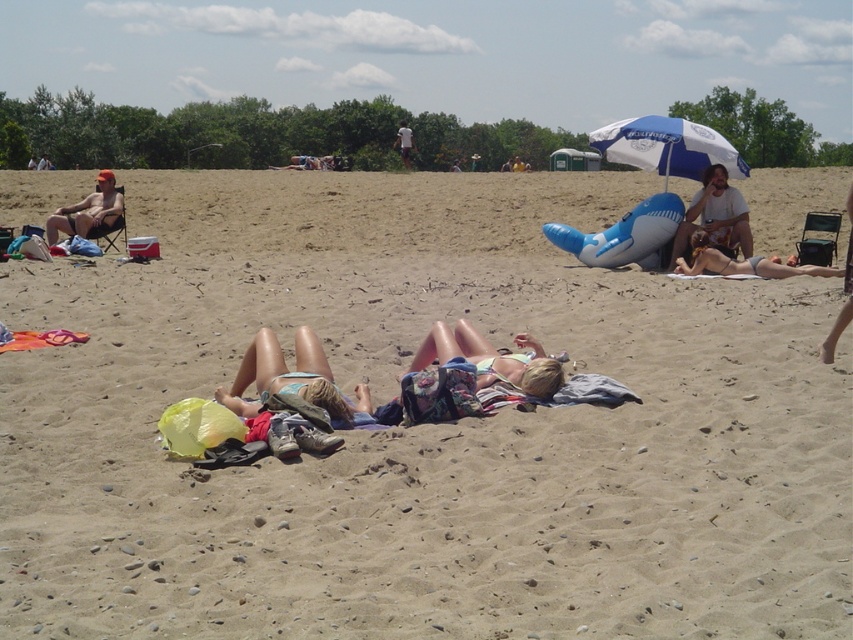
Question: Where is tan bikini at center located in relation to blue and white striped umbrella at upper right in the image?

Choices:
 (A) left
 (B) right

Answer: (A)

Question: Estimate the real-world distances between objects in this image. Which object is closer to the gray fabric bikini at right?

Choices:
 (A) tan bikini at center
 (B) blue and white striped umbrella at upper right
 (C) white cotton shirt at upper center
 (D) matte orange cap at left

Answer: (B)

Question: Which point is closer to the camera taking this photo?

Choices:
 (A) (404, 150)
 (B) (630, 145)

Answer: (B)

Question: Can you confirm if blue and white striped umbrella at upper right is positioned to the left of white cotton shirt at upper center?

Choices:
 (A) yes
 (B) no

Answer: (B)

Question: Where is matte orange cap at left located in relation to gray fabric bikini at right in the image?

Choices:
 (A) left
 (B) right

Answer: (A)

Question: Which object is positioned farthest from the matte orange cap at left?

Choices:
 (A) tan bikini at center
 (B) white cotton shirt at upper center
 (C) beige fabric towel at upper right
 (D) gray fabric bikini at right

Answer: (B)